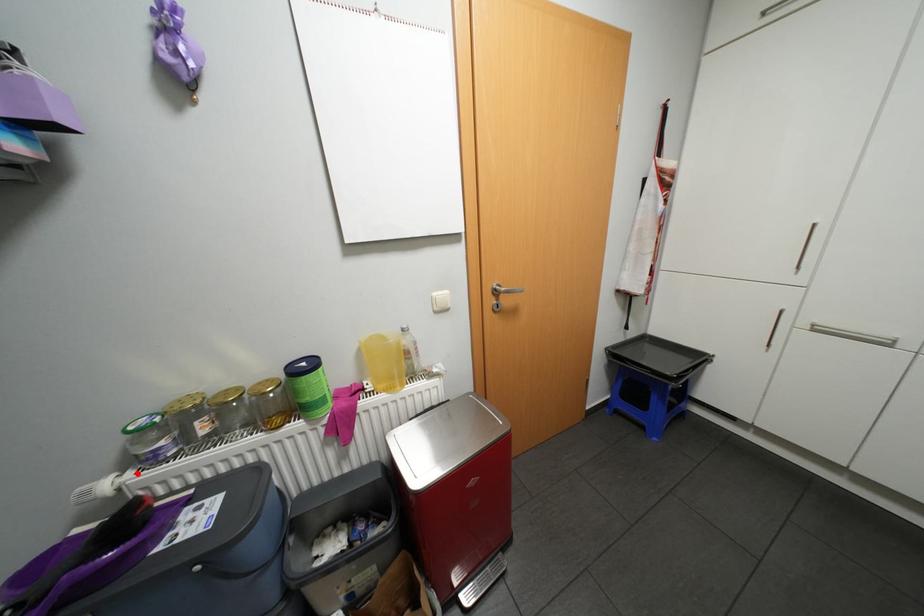
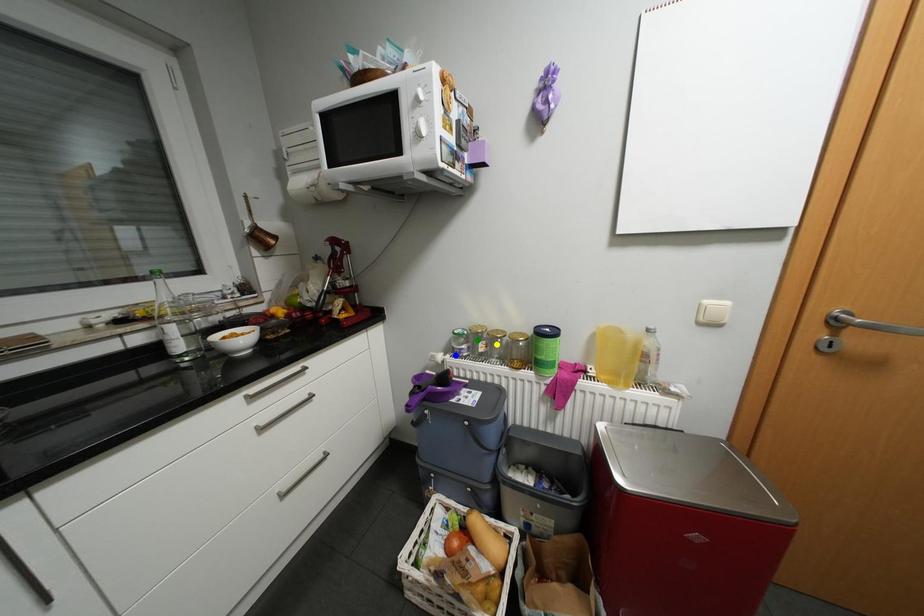
Question: I am providing you with two images of the same scene from different viewpoints. A red point is marked on the first image. You are given multiple points on the second image. Which point in image 2 represents the same 3d spot as the red point in image 1?

Choices:
 (A) blue point
 (B) yellow point
 (C) green point

Answer: (A)